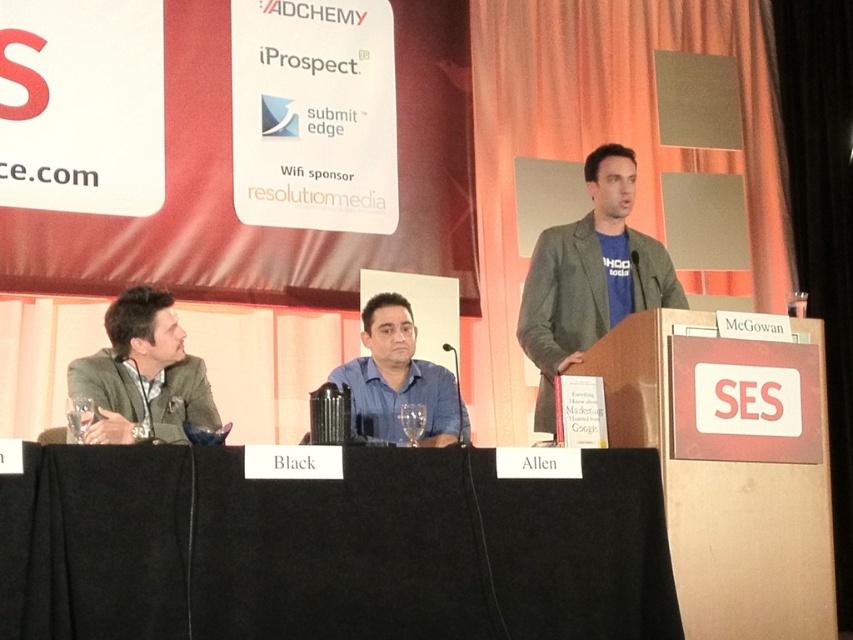
Question: Which of these objects is positioned closest to the black fabric table at center?

Choices:
 (A) blue cotton t-shirt at center
 (B) blue shirt at center
 (C) matte gray suit at left

Answer: (C)

Question: Does blue cotton t-shirt at center have a larger size compared to blue shirt at center?

Choices:
 (A) no
 (B) yes

Answer: (B)

Question: Is black fabric table at center to the right of matte gray suit at left from the viewer's perspective?

Choices:
 (A) yes
 (B) no

Answer: (A)

Question: Which point is closer to the camera?

Choices:
 (A) black fabric table at center
 (B) blue cotton t-shirt at center

Answer: (A)

Question: Which of the following is the closest to the observer?

Choices:
 (A) blue cotton t-shirt at center
 (B) black fabric table at center

Answer: (B)

Question: Can you confirm if black fabric table at center is positioned below blue cotton t-shirt at center?

Choices:
 (A) no
 (B) yes

Answer: (B)